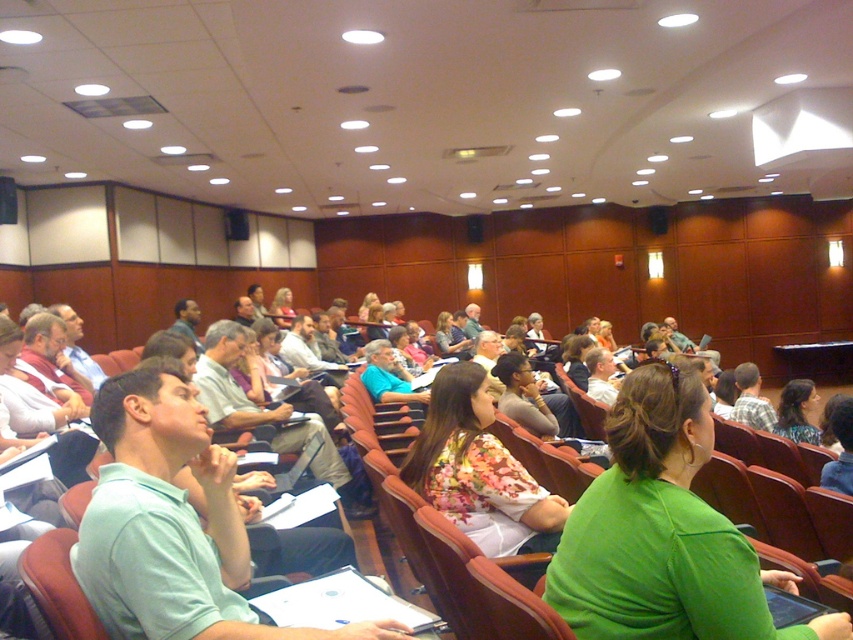
Is floral print blouse at center smaller than floral fabric dress at center?

No.

Is floral print blouse at center bigger than floral fabric dress at center?

Indeed, floral print blouse at center has a larger size compared to floral fabric dress at center.

Between point (485, 502) and point (785, 392), which one is positioned behind?

Point (785, 392)

Where is `floral print blouse at center`? The width and height of the screenshot is (853, 640). floral print blouse at center is located at coordinates (479, 470).